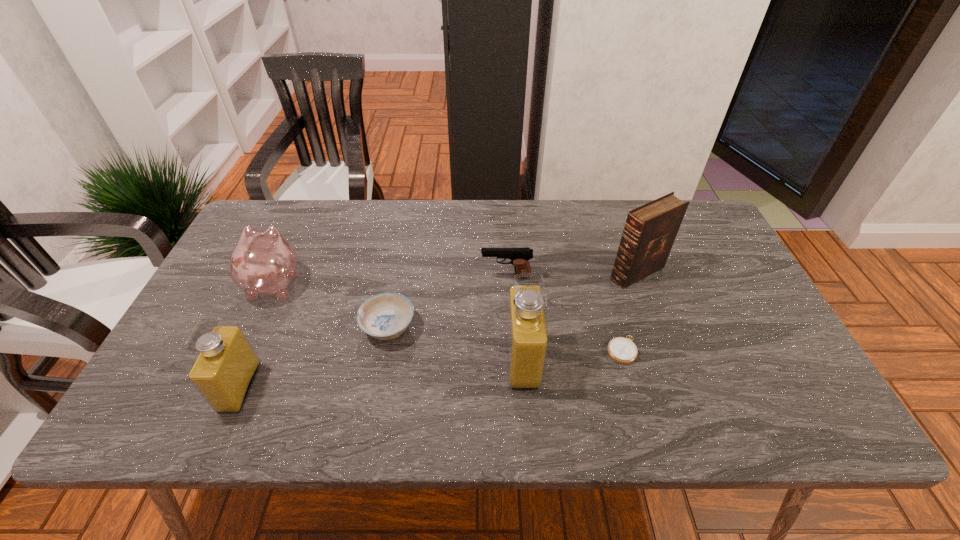
This screenshot has height=540, width=960. I want to click on vacant space that satisfies the following two spatial constraints: 1. on the front side of the third object from left to right; 2. on the front-facing side of the shorter perfume, so click(x=377, y=387).

Identify the location of free spot that satisfies the following two spatial constraints: 1. at the barrel of the third shortest object; 2. on the left side of the shortest object. (511, 350).

Find the location of a particular element. vacant space that satisfies the following two spatial constraints: 1. on the front side of the compass; 2. on the front-facing side of the right perfume is located at coordinates (624, 360).

The height and width of the screenshot is (540, 960). I want to click on vacant space that satisfies the following two spatial constraints: 1. on the front side of the Bible; 2. on the front-facing side of the taller perfume, so click(x=668, y=360).